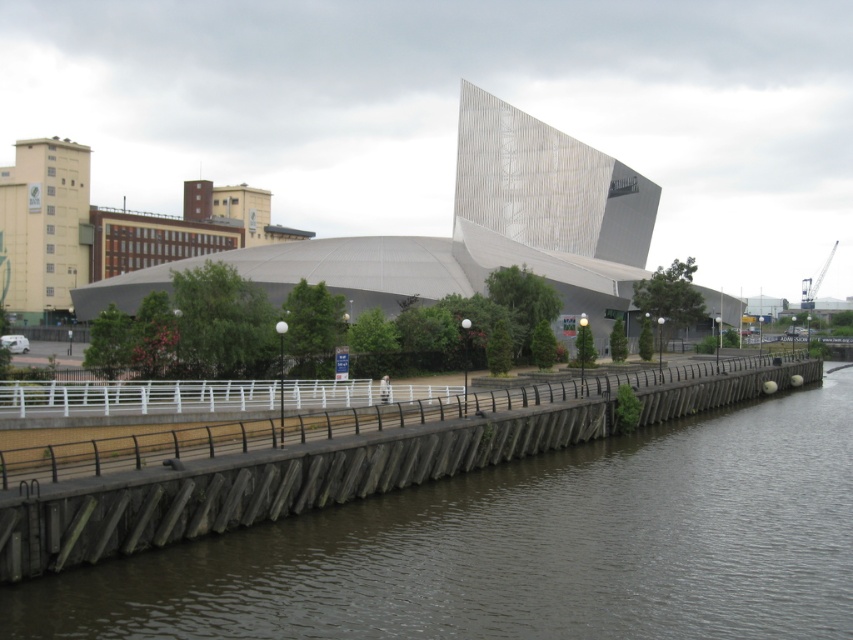
You are standing at the wooden walkway and want to reach the point closer to you in the scene. Which of the two points, point (811, 435) or point (277, 291), should you head towards?

You should head towards point (811, 435) because it is closer to the viewer than point (277, 291).

You are standing at the camera position and want to walk to the brown concrete river at lower left. Is the distance less than 50 feet?

The distance between the camera and the brown concrete river at lower left is 46.07 feet, which is less than 50 feet. Therefore, you can reach it within 50 feet.

You are standing on the wooden walkway and want to cross to the other side of the brown concrete river at lower left. The white concrete bridge at center is nearby. Which structure should you use to cross the river?

You should use the white concrete bridge at center to cross the river because the brown concrete river at lower left has a lesser height and is likely the waterway itself, not a crossing structure.